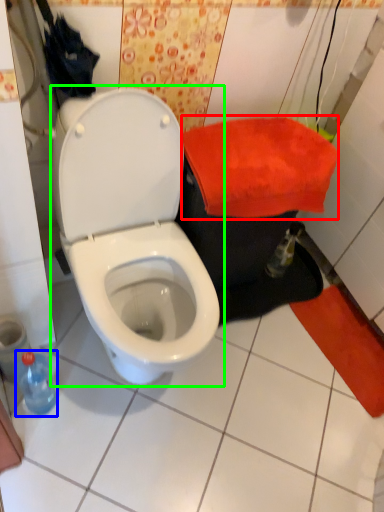
Question: Which is farther away from beach towel (highlighted by a red box)? bottle (highlighted by a blue box) or toilet (highlighted by a green box)?

Choices:
 (A) bottle
 (B) toilet

Answer: (A)